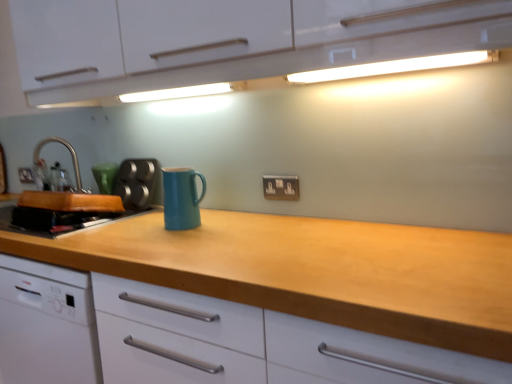
Question: Does matte silver electric outlet at center appear on the left side of wooden at center?

Choices:
 (A) yes
 (B) no

Answer: (A)

Question: Is matte silver electric outlet at center smaller than wooden at center?

Choices:
 (A) yes
 (B) no

Answer: (A)

Question: From the image's perspective, is matte silver electric outlet at center on top of wooden at center?

Choices:
 (A) no
 (B) yes

Answer: (B)

Question: From a real-world perspective, is matte silver electric outlet at center beneath wooden at center?

Choices:
 (A) yes
 (B) no

Answer: (B)

Question: Is matte silver electric outlet at center facing away from wooden at center?

Choices:
 (A) no
 (B) yes

Answer: (A)

Question: Considering the relative sizes of matte silver electric outlet at center and wooden at center in the image provided, is matte silver electric outlet at center bigger than wooden at center?

Choices:
 (A) no
 (B) yes

Answer: (A)

Question: Is metallic silver muffin tin at left positioned with its back to matte silver electric outlet at center?

Choices:
 (A) no
 (B) yes

Answer: (A)

Question: Considering the relative sizes of metallic silver muffin tin at left and matte silver electric outlet at center in the image provided, is metallic silver muffin tin at left wider than matte silver electric outlet at center?

Choices:
 (A) no
 (B) yes

Answer: (B)

Question: From the image's perspective, is metallic silver muffin tin at left on top of matte silver electric outlet at center?

Choices:
 (A) no
 (B) yes

Answer: (B)

Question: Is metallic silver muffin tin at left thinner than matte silver electric outlet at center?

Choices:
 (A) yes
 (B) no

Answer: (B)

Question: Is metallic silver muffin tin at left to the right of matte silver electric outlet at center from the viewer's perspective?

Choices:
 (A) yes
 (B) no

Answer: (B)

Question: Does metallic silver muffin tin at left have a greater height compared to matte silver electric outlet at center?

Choices:
 (A) yes
 (B) no

Answer: (A)

Question: Is matte silver electric outlet at center facing towards wooden cutting board at left, which ranks as the 1th kitchen appliance in left-to-right order?

Choices:
 (A) yes
 (B) no

Answer: (B)